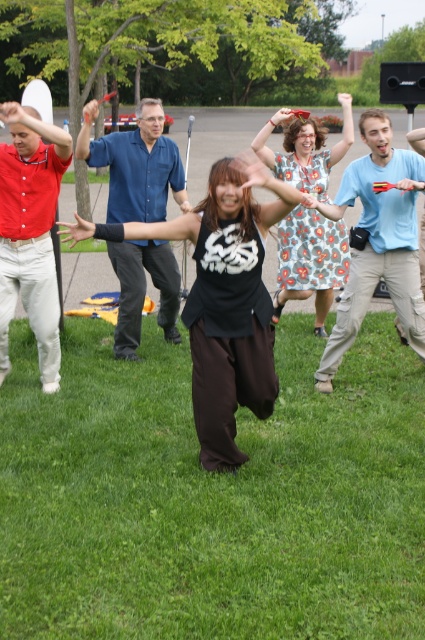
Is light blue cotton shirt at center taller than blue button-down shirt at center?

Yes, light blue cotton shirt at center is taller than blue button-down shirt at center.

Can you confirm if light blue cotton shirt at center is bigger than blue button-down shirt at center?

Yes, light blue cotton shirt at center is bigger than blue button-down shirt at center.

Locate an element on the screen. light blue cotton shirt at center is located at coordinates (376, 241).

At what (x,y) coordinates should I click in order to perform the action: click on light blue cotton shirt at center. Please return your answer as a coordinate pair (x, y). Looking at the image, I should click on (376, 241).

Is light blue cotton shirt at center taller than matte red shirt at left?

In fact, light blue cotton shirt at center may be shorter than matte red shirt at left.

Does point (363, 196) come farther from viewer compared to point (0, 204)?

Yes, it is.

I want to click on light blue cotton shirt at center, so click(x=376, y=241).

Which is more to the right, green grass at center or light blue cotton shirt at center?

Positioned to the right is light blue cotton shirt at center.

Is green grass at center wider than light blue cotton shirt at center?

Indeed, green grass at center has a greater width compared to light blue cotton shirt at center.

Who is more distant from viewer, (362, 540) or (396, 209)?

Point (396, 209)

Identify the location of green grass at center. (212, 497).